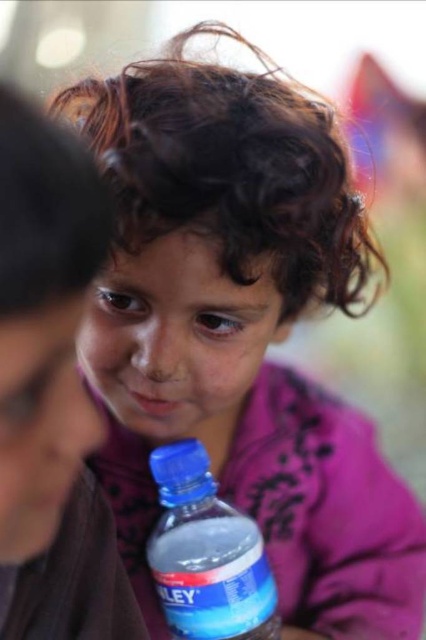
Image resolution: width=426 pixels, height=640 pixels. What do you see at coordinates (51, 392) in the screenshot?
I see `matte plastic bottle at lower center` at bounding box center [51, 392].

Does matte plastic bottle at lower center have a lesser height compared to blue plastic bottle at lower center?

Incorrect, matte plastic bottle at lower center's height does not fall short of blue plastic bottle at lower center's.

Find the location of a particular element. This screenshot has height=640, width=426. matte plastic bottle at lower center is located at coordinates 51,392.